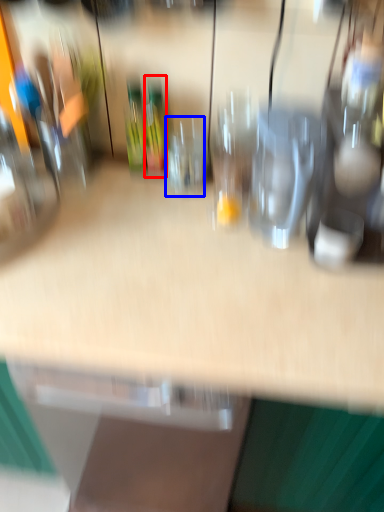
Question: Among these objects, which one is nearest to the camera, wine bottle (highlighted by a red box) or wine glass (highlighted by a blue box)?

Choices:
 (A) wine bottle
 (B) wine glass

Answer: (B)